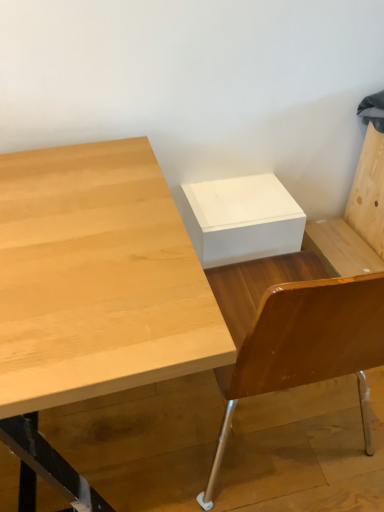
Where is `white matte box at center`? This screenshot has width=384, height=512. white matte box at center is located at coordinates (241, 219).

Image resolution: width=384 pixels, height=512 pixels. What do you see at coordinates (241, 219) in the screenshot?
I see `white matte box at center` at bounding box center [241, 219].

At what (x,y) coordinates should I click in order to perform the action: click on white matte box at center. Please return your answer as a coordinate pair (x, y). This screenshot has width=384, height=512. Looking at the image, I should click on (241, 219).